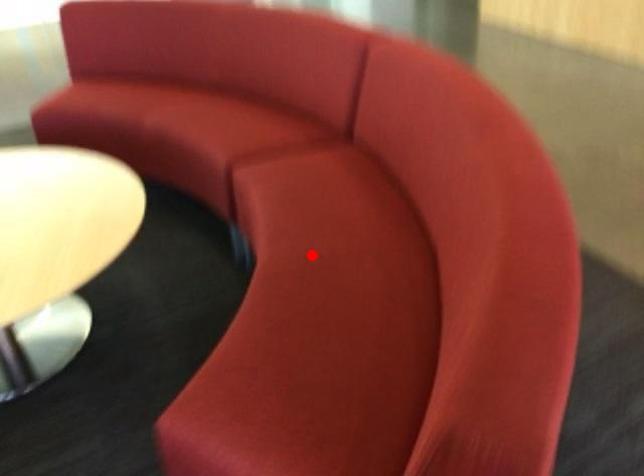
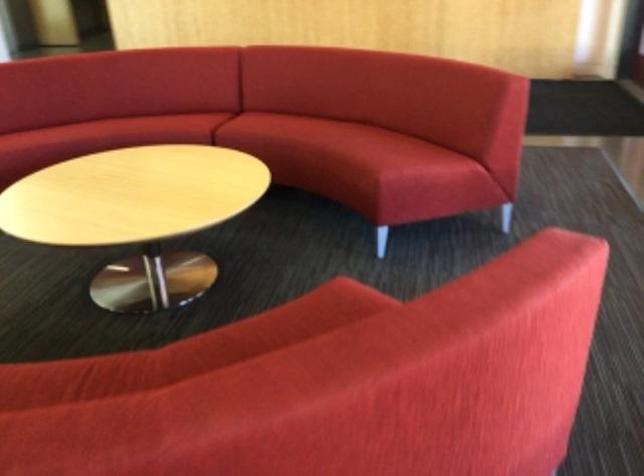
Question: I am providing you with two images of the same scene from different viewpoints. Given a red point in image1, look at the same physical point in image2. Is it:

Choices:
 (A) Closer to the viewpoint
 (B) Farther from the viewpoint

Answer: (B)